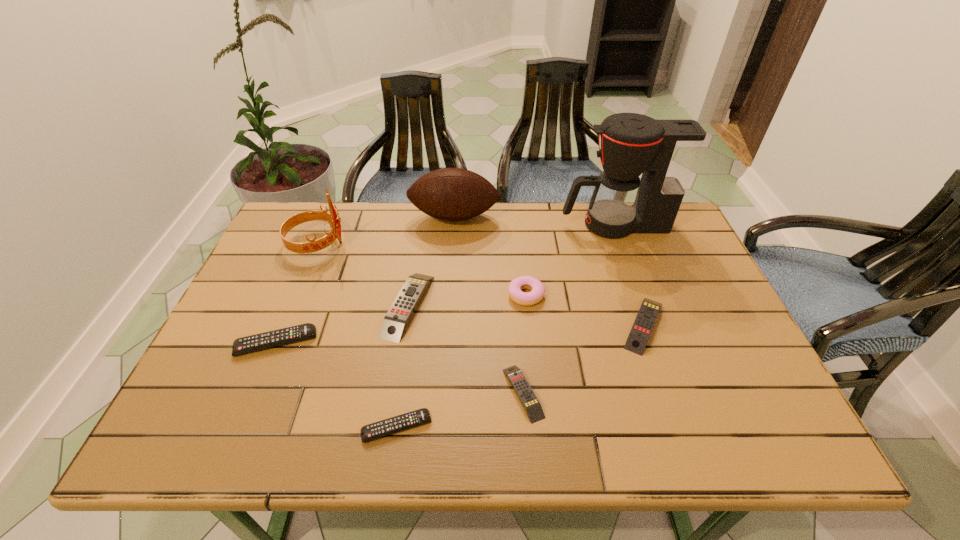
Where is `coffee maker`? The image size is (960, 540). coffee maker is located at coordinates (665, 152).

Identify the location of tiara. The width and height of the screenshot is (960, 540). (332, 218).

Where is `brown football`? The height and width of the screenshot is (540, 960). brown football is located at coordinates (453, 194).

In order to click on football in this screenshot , I will do `click(453, 194)`.

The image size is (960, 540). In order to click on doughnut in this screenshot , I will do `click(537, 288)`.

Identify the location of the biggest yellow remote control. Image resolution: width=960 pixels, height=540 pixels. (395, 321).

Where is `the tallest remote control`? the tallest remote control is located at coordinates (395, 321).

Where is `the rightmost remote control`? The height and width of the screenshot is (540, 960). the rightmost remote control is located at coordinates (640, 332).

The image size is (960, 540). I want to click on the rightmost yellow remote control, so click(x=640, y=332).

The image size is (960, 540). I want to click on the leftmost remote control, so click(x=247, y=344).